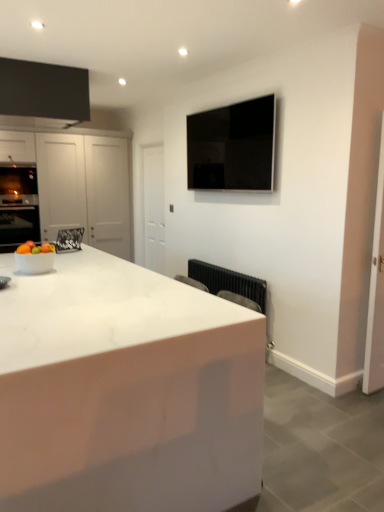
Question: In the image, is black metallic radiator at lower center positioned in front of or behind white glossy cabinet at left?

Choices:
 (A) front
 (B) behind

Answer: (A)

Question: From the image's perspective, is black metallic radiator at lower center above or below white glossy cabinet at left?

Choices:
 (A) above
 (B) below

Answer: (B)

Question: Based on their relative distances, which object is farther from the shiny white bowl at left?

Choices:
 (A) black metallic radiator at lower center
 (B) white glossy cabinet at left
 (C) black glossy tv at upper center
 (D) white glossy bowl at lower left
 (E) white marble countertop at center

Answer: (B)

Question: Which of these objects is positioned farthest from the shiny white bowl at left?

Choices:
 (A) white marble countertop at center
 (B) black glossy tv at upper center
 (C) white glossy cabinet at left
 (D) black metallic radiator at lower center
 (E) white glossy bowl at lower left

Answer: (C)